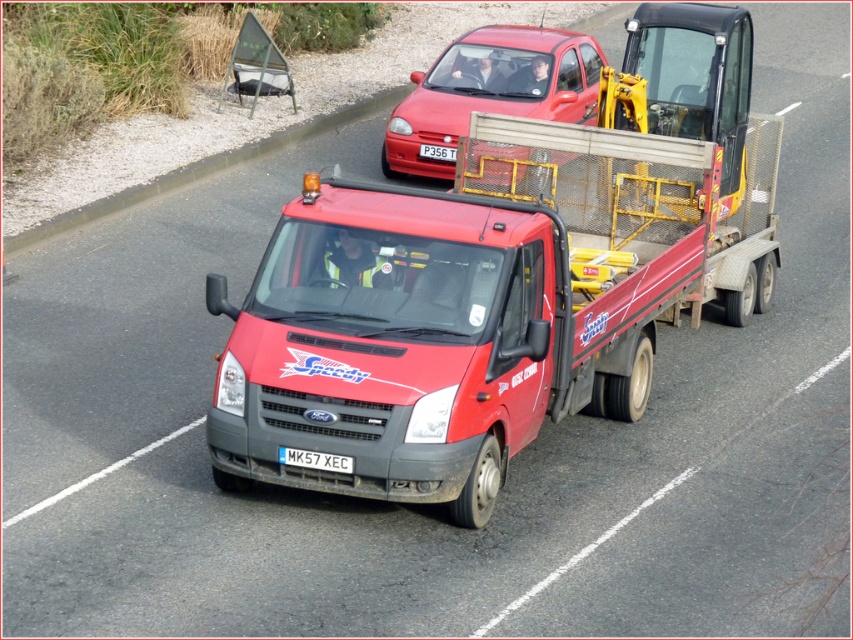
You are a pedestrian standing on the side of the road. You see the matte red tow truck at center and the red plastic license plate at center. Which object is taller?

The red plastic license plate at center is taller than the matte red tow truck at center.